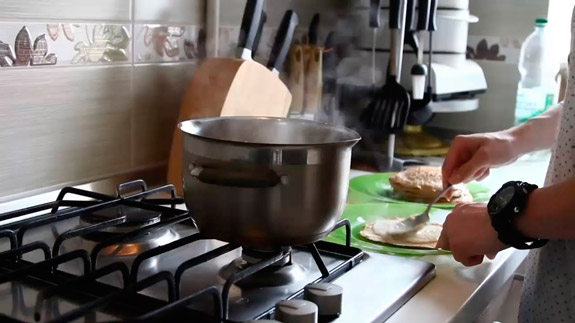
Image resolution: width=575 pixels, height=323 pixels. Find the location of `stove burners`. stove burners is located at coordinates (128, 210), (251, 257).